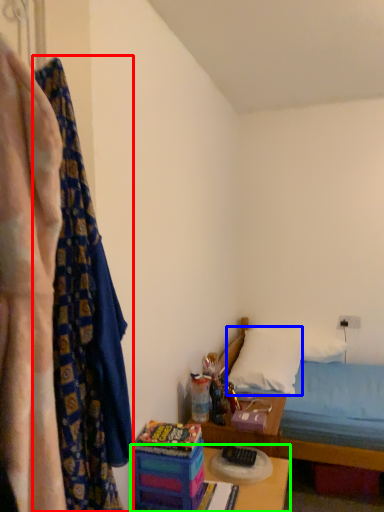
Question: Estimate the real-world distances between objects in this image. Which object is farther from curtain (highlighted by a red box), pillow (highlighted by a blue box) or table (highlighted by a green box)?

Choices:
 (A) pillow
 (B) table

Answer: (A)